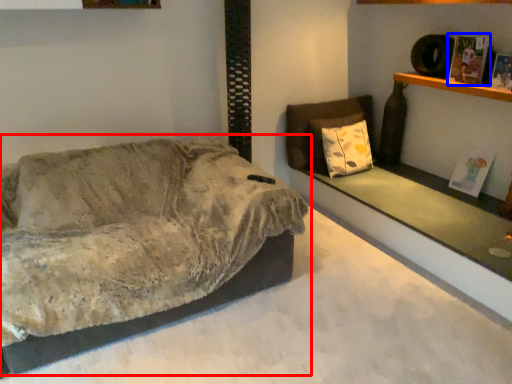
Question: Which of the following is the farthest to the observer, studio couch (highlighted by a red box) or magazine (highlighted by a blue box)?

Choices:
 (A) studio couch
 (B) magazine

Answer: (B)